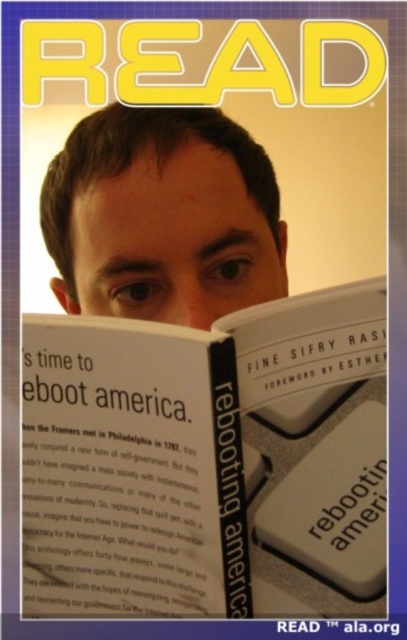
You are a librarian trying to organize books on a shelf. The shelf has a width of 8 inches. You have a white paper book at center and a matte skin at center. Can both items fit side by side on the shelf without overlapping?

The white paper book at center and matte skin at center are 8.20 inches apart, so they cannot fit side by side on an 8 inch shelf without overlapping.

You are standing 10 feet away from the image. The point at (172, 556) is part of the book titled

The point at (172, 556) is 17.02 inches from the viewer, so it is within the 10 feet distance. Therefore, the point is part of the book titled